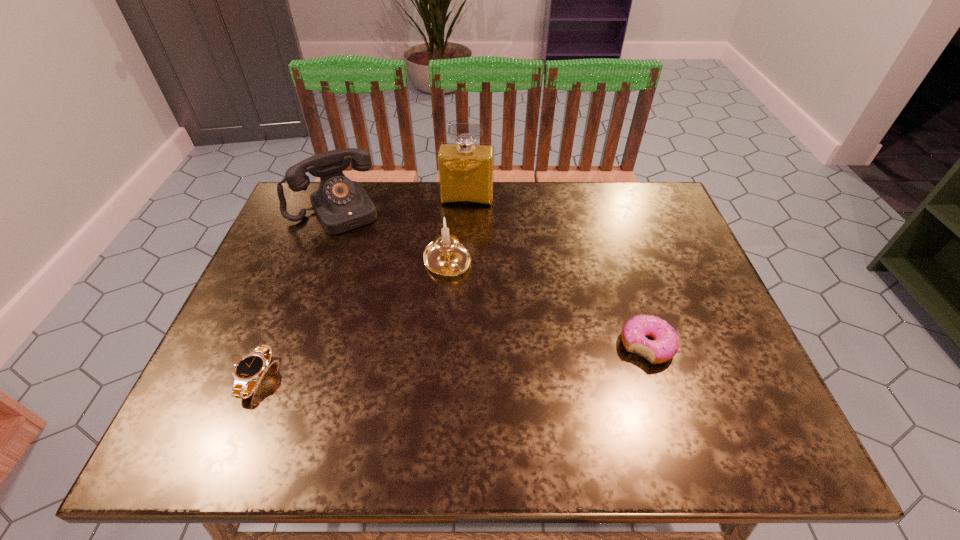
Find the location of a particular element. This screenshot has height=540, width=960. the shortest object is located at coordinates (250, 368).

Locate an element on the screen. The width and height of the screenshot is (960, 540). doughnut is located at coordinates (665, 343).

I want to click on the rightmost object, so click(665, 343).

I want to click on candle holder, so click(445, 256).

Where is `perfume`? perfume is located at coordinates (465, 169).

Find the location of a particular element. Image resolution: width=960 pixels, height=540 pixels. telephone is located at coordinates (340, 204).

Identify the location of vacant space located on the back of the watch. The image size is (960, 540). (307, 251).

You are a GUI agent. You are given a task and a screenshot of the screen. Output one action in this format:
    pyautogui.click(x=<x>, y=<y>)
    Task: Click on the blank space located on the left of the rightmost object
    This screenshot has width=960, height=540.
    Given the screenshot: What is the action you would take?
    pyautogui.click(x=489, y=346)

You are a GUI agent. You are given a task and a screenshot of the screen. Output one action in this format:
    pyautogui.click(x=<x>, y=<y>)
    Task: Click on the blank space located 0.190m on the handle side of the third nearest object
    This screenshot has width=960, height=540.
    Given the screenshot: What is the action you would take?
    click(494, 337)

I want to click on free space located 0.280m on the handle side of the third nearest object, so click(x=515, y=367).